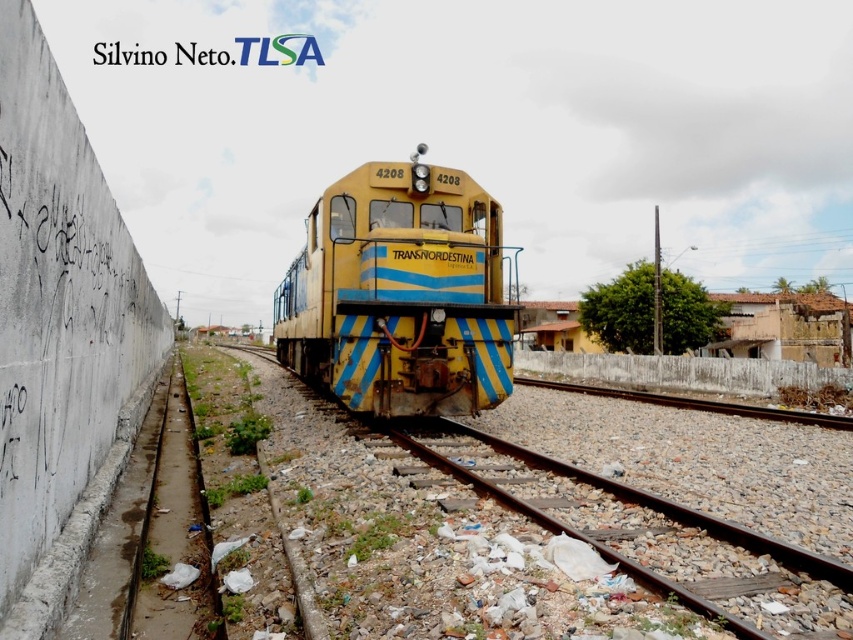
Question: Is yellow matte train at center closer to the viewer compared to rusty metal train track at center?

Choices:
 (A) yes
 (B) no

Answer: (B)

Question: Does yellow matte train at center appear under rusty metal train track at center?

Choices:
 (A) no
 (B) yes

Answer: (A)

Question: Among these points, which one is nearest to the camera?

Choices:
 (A) (357, 179)
 (B) (712, 531)

Answer: (B)

Question: Which object is farther from the camera taking this photo?

Choices:
 (A) rusty metal train track at center
 (B) yellow matte train at center

Answer: (B)

Question: Does yellow matte train at center have a greater width compared to rusty metal train track at center?

Choices:
 (A) yes
 (B) no

Answer: (A)

Question: Which point is closer to the camera?

Choices:
 (A) (642, 552)
 (B) (358, 314)

Answer: (A)